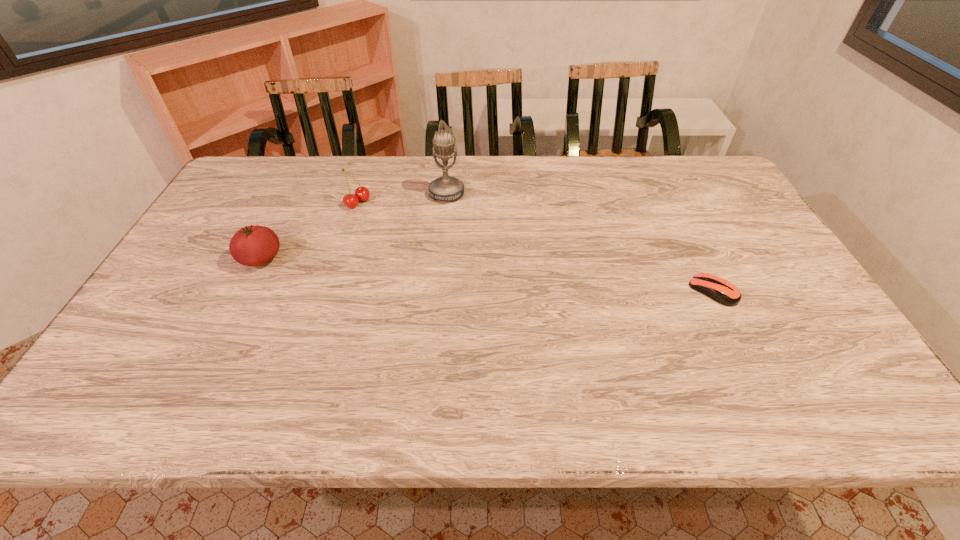
The width and height of the screenshot is (960, 540). In the image, there is a desktop. Identify the location of vacant space at the left edge. (212, 286).

This screenshot has width=960, height=540. In the image, there is a desktop. Identify the location of vacant space at the far left corner. (260, 193).

Identify the location of vacant space at the far right corner of the desktop. (684, 188).

Image resolution: width=960 pixels, height=540 pixels. I want to click on empty location between the tomato and the microphone, so click(x=354, y=226).

At what (x,y) coordinates should I click in order to perform the action: click on empty location between the tallest object and the third farthest object. Please return your answer as a coordinate pair (x, y). This screenshot has width=960, height=540. Looking at the image, I should click on (354, 226).

Identify the location of free spot between the cherry and the tomato. [x=309, y=231].

Find the location of `vacant point located between the tomato and the microphone`. vacant point located between the tomato and the microphone is located at coordinates (354, 226).

Where is `free space between the cherry and the microphone`? The image size is (960, 540). free space between the cherry and the microphone is located at coordinates point(402,198).

This screenshot has height=540, width=960. What are the coordinates of `free spot between the leftmost object and the cherry` in the screenshot? It's located at (309, 231).

Where is `vacant region between the third farthest object and the computer mouse`? vacant region between the third farthest object and the computer mouse is located at coordinates (487, 275).